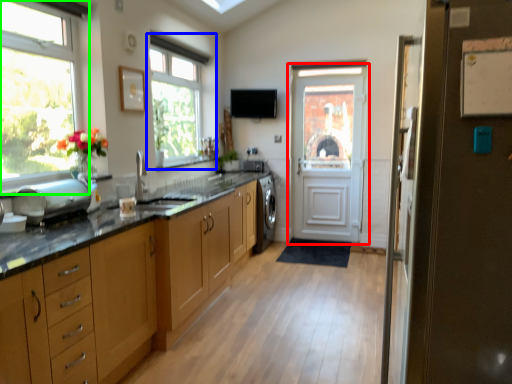
Question: Which object is positioned farthest from door (highlighted by a red box)? Select from window (highlighted by a blue box) and window (highlighted by a green box).

Choices:
 (A) window
 (B) window

Answer: (B)